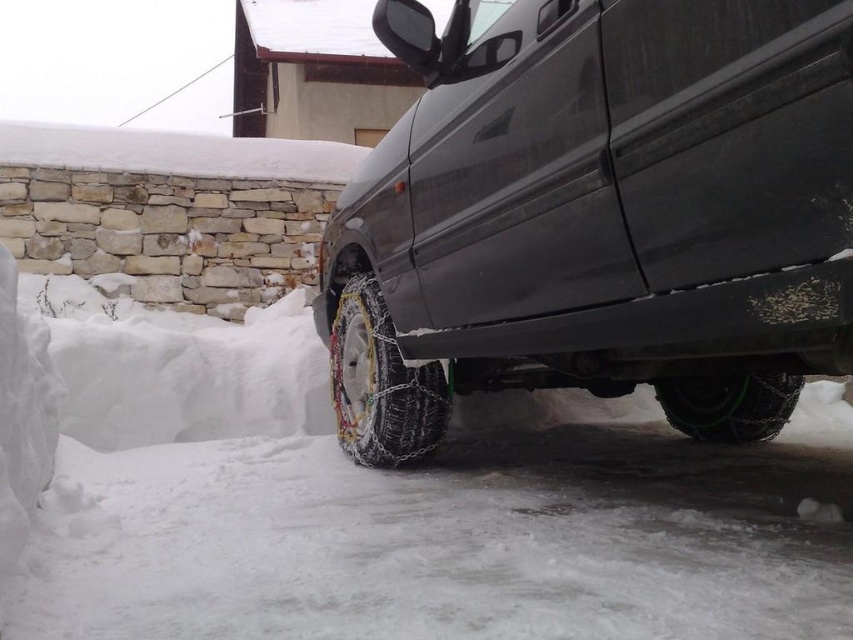
Between metallic chain-link tire at lower center and green rubber tire at lower right, which one appears on the left side from the viewer's perspective?

metallic chain-link tire at lower center is more to the left.

Measure the distance between point (379, 404) and camera.

They are 1.96 meters apart.

Locate an element on the screen. This screenshot has height=640, width=853. metallic chain-link tire at lower center is located at coordinates (380, 385).

Is matte black van at center positioned before metallic chain-link tire at lower center?

Yes, matte black van at center is closer to the viewer.

Describe the element at coordinates (592, 209) in the screenshot. I see `matte black van at center` at that location.

Locate an element on the screen. matte black van at center is located at coordinates (592, 209).

Which is above, matte black van at center or green rubber tire at lower right?

matte black van at center is above.

Is matte black van at center to the right of green rubber tire at lower right from the viewer's perspective?

No, matte black van at center is not to the right of green rubber tire at lower right.

This screenshot has height=640, width=853. What do you see at coordinates (592, 209) in the screenshot? I see `matte black van at center` at bounding box center [592, 209].

At what (x,y) coordinates should I click in order to perform the action: click on matte black van at center. Please return your answer as a coordinate pair (x, y). Looking at the image, I should click on click(592, 209).